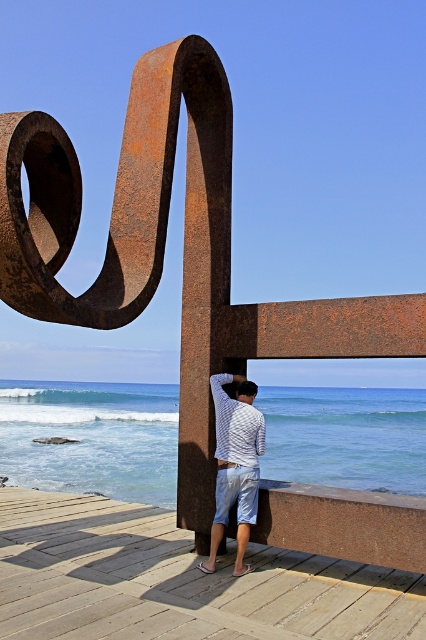
You are a photographer planning to take a picture of the blue water at lower center and the white striped shirt at center. Based on their positions, which object appears larger in the photo?

The blue water at lower center appears larger in the photo because it is taller than the white striped shirt at center.

You are a photographer trying to capture the rustic wood dock at lower center and the white striped shirt at center in the same frame. Based on their heights, which object should you focus on first to ensure both are in the shot?

The rustic wood dock at lower center is not as tall as the white striped shirt at center, so you should focus on the taller white striped shirt at center first to ensure both are in the frame.